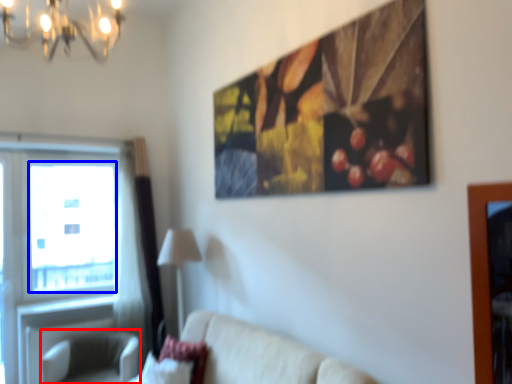
Question: Among these objects, which one is nearest to the camera, swivel chair (highlighted by a red box) or window screen (highlighted by a blue box)?

Choices:
 (A) swivel chair
 (B) window screen

Answer: (A)